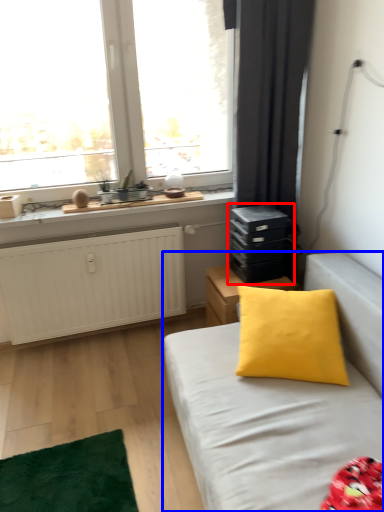
Question: Which object appears closest to the camera in this image, dresser (highlighted by a red box) or studio couch (highlighted by a blue box)?

Choices:
 (A) dresser
 (B) studio couch

Answer: (B)